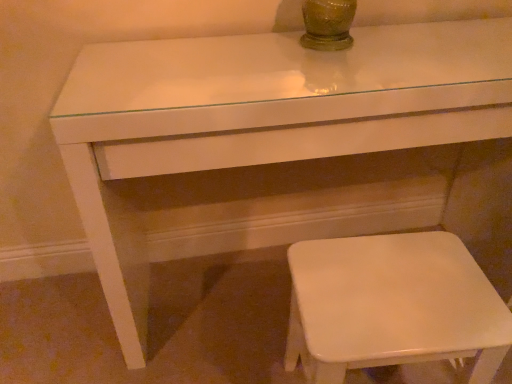
Locate an element on the screen. vacant space situated above white glossy stool at lower right (from a real-world perspective) is located at coordinates (398, 285).